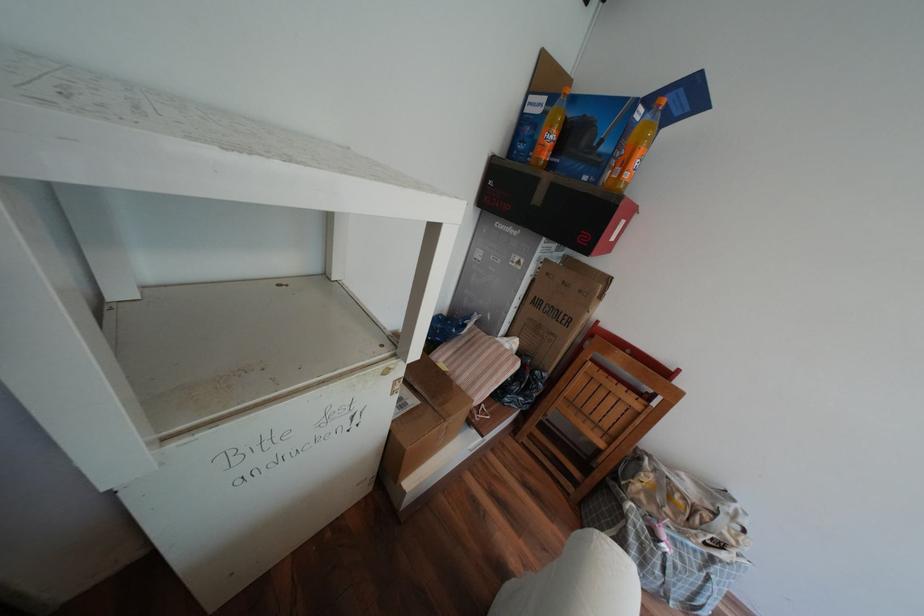
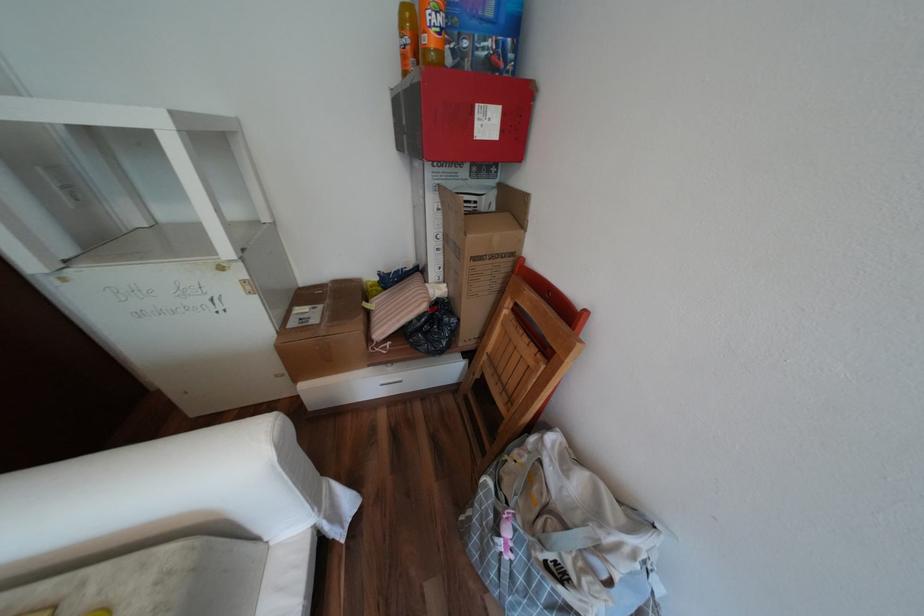
Question: Which direction would the cameraman need to move to produce the second image? Reply with the corresponding letter.

Choices:
 (A) Left
 (B) Right
 (C) Forward
 (D) Backward

Answer: (B)